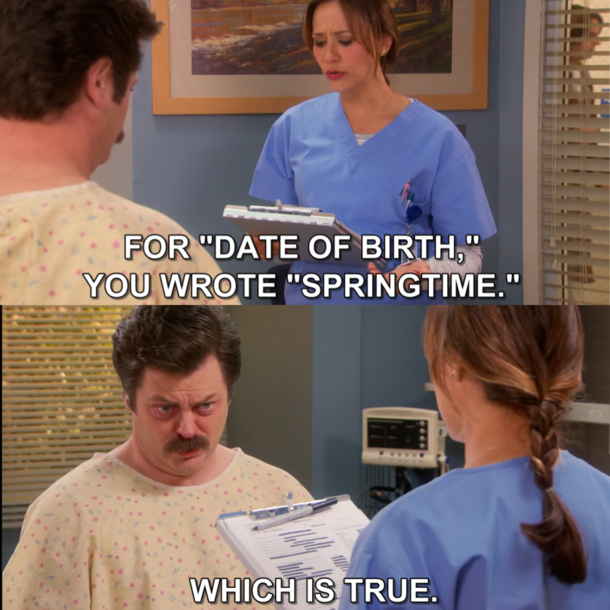
I want to click on medical monitoring machine, so click(x=396, y=451).